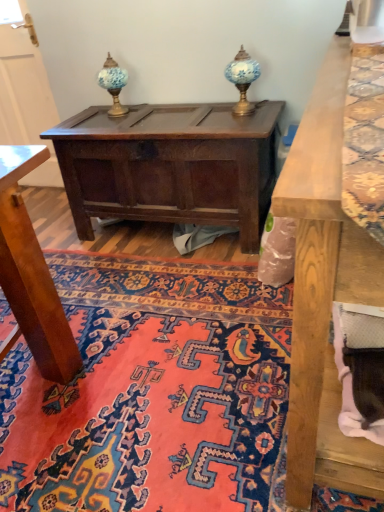
Locate an element on the screen. The image size is (384, 512). vacant area to the right of blue glass table lamp at upper center, which is counted as the 1th table lamp, starting from the left is located at coordinates (162, 108).